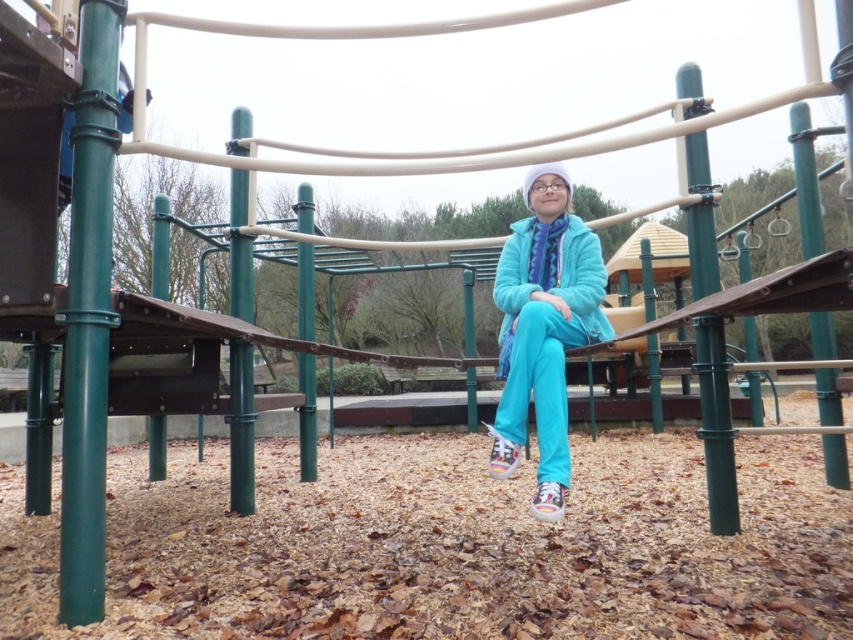
Question: Which point is farther to the camera?

Choices:
 (A) (509, 403)
 (B) (514, 240)

Answer: (B)

Question: Is turquoise fabric jacket at center to the right of matte blue jacket at center from the viewer's perspective?

Choices:
 (A) yes
 (B) no

Answer: (A)

Question: Does turquoise fabric jacket at center appear under matte blue jacket at center?

Choices:
 (A) yes
 (B) no

Answer: (A)

Question: Which point is closer to the camera taking this photo?

Choices:
 (A) (589, 237)
 (B) (560, 253)

Answer: (A)

Question: Which point appears farthest from the camera in this image?

Choices:
 (A) (529, 232)
 (B) (534, 291)

Answer: (A)

Question: Is turquoise fabric jacket at center further to the viewer compared to matte blue jacket at center?

Choices:
 (A) yes
 (B) no

Answer: (B)